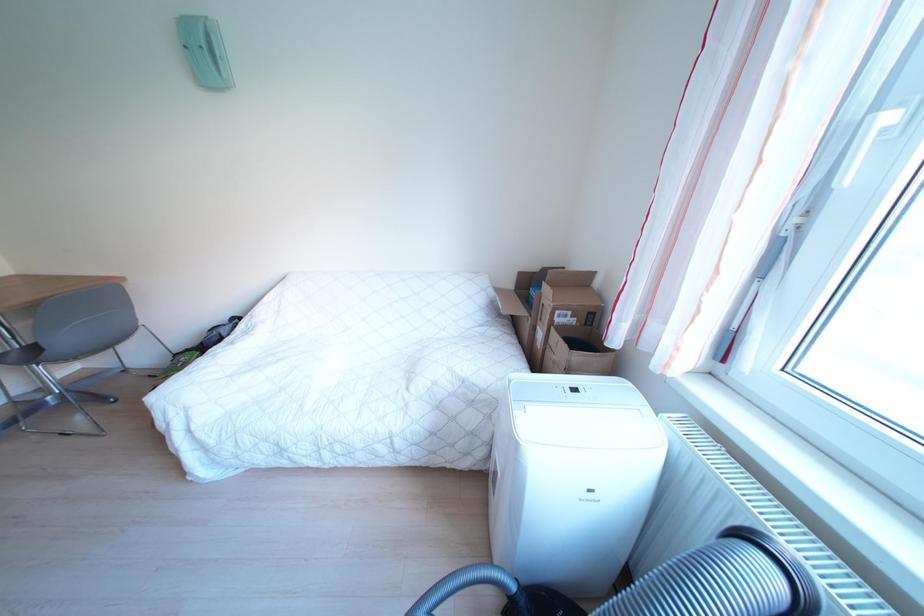
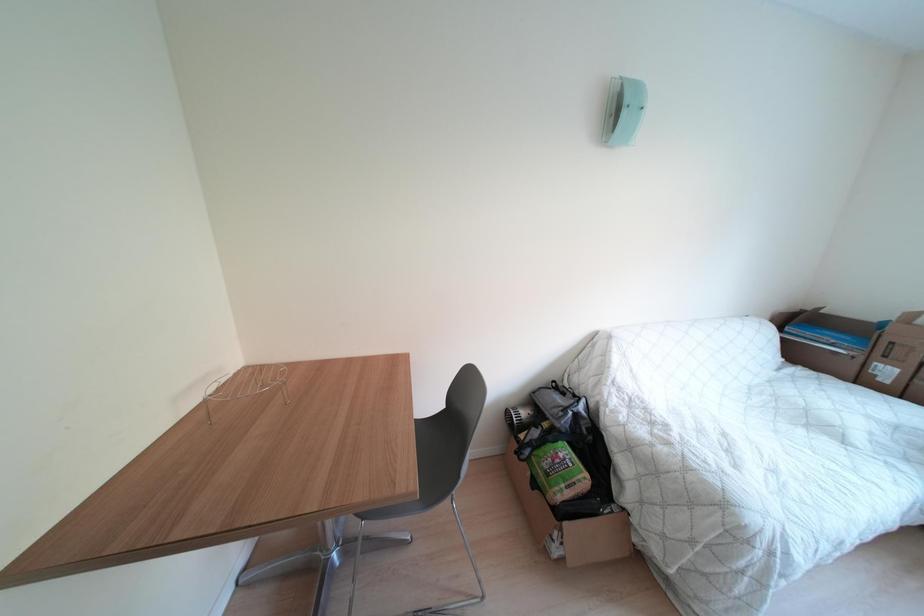
Question: Which direction would the cameraman need to move to produce the second image? Reply with the corresponding letter.

Choices:
 (A) Left
 (B) Right
 (C) Forward
 (D) Backward

Answer: (A)